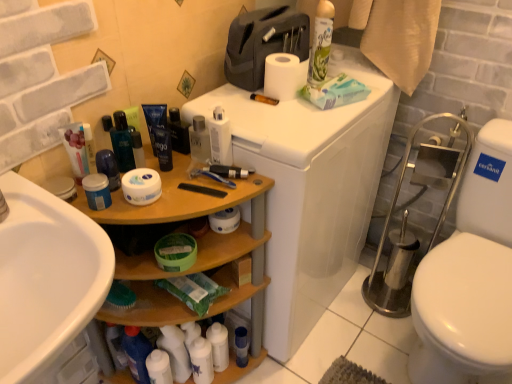
Question: Does point (129, 380) appear closer or farther from the camera than point (101, 188)?

Choices:
 (A) closer
 (B) farther

Answer: (B)

Question: From their relative heights in the image, would you say wooden shelf at left is taller or shorter than blue matte jar at left, the eleventh toiletry viewed from the right?

Choices:
 (A) tall
 (B) short

Answer: (A)

Question: Estimate the real-world distances between objects in this image. Which object is closer to the white matte toilet paper at upper center?

Choices:
 (A) white glossy lotion at upper center, which is the second toiletry in right-to-left order
 (B) white glossy bottle at lower center, which is the tenth toiletry from left to right
 (C) matte blue jar at center, positioned as the 3th toiletry in left-to-right order
 (D) white plastic toilet at upper right
 (E) shiny blue bottle at center

Answer: (A)

Question: Based on their relative distances, which object is farther from the white glossy bottle at lower left, arranged as the ninth toiletry when viewed from the right?

Choices:
 (A) blue plastic cup at lower center, the 12th toiletry viewed from the left
 (B) blue matte shaving cream at center, the 6th toiletry from the right
 (C) white glossy toilet paper at upper right
 (D) shiny black bottle at center, the 5th toiletry in the right-to-left sequence
 (E) wooden shelf at left

Answer: (C)